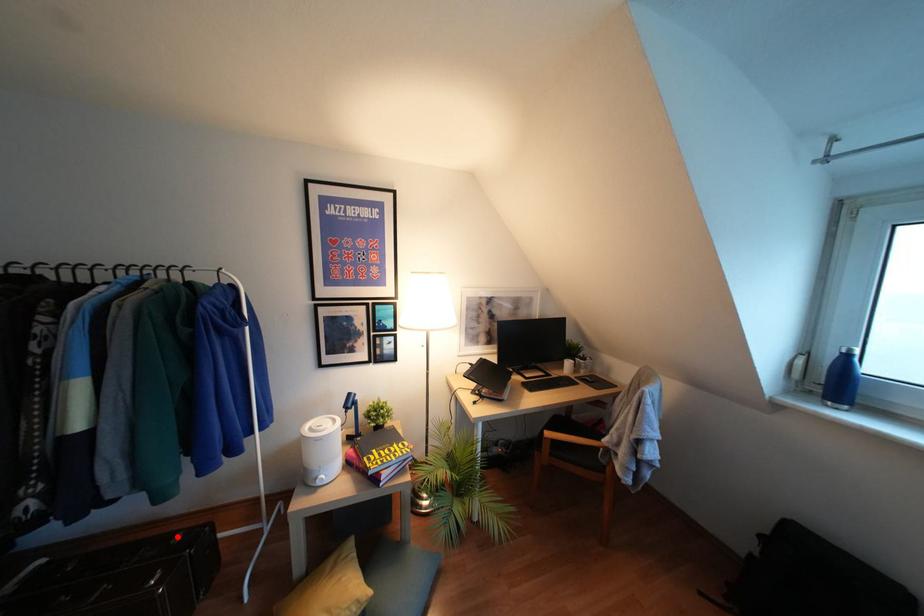
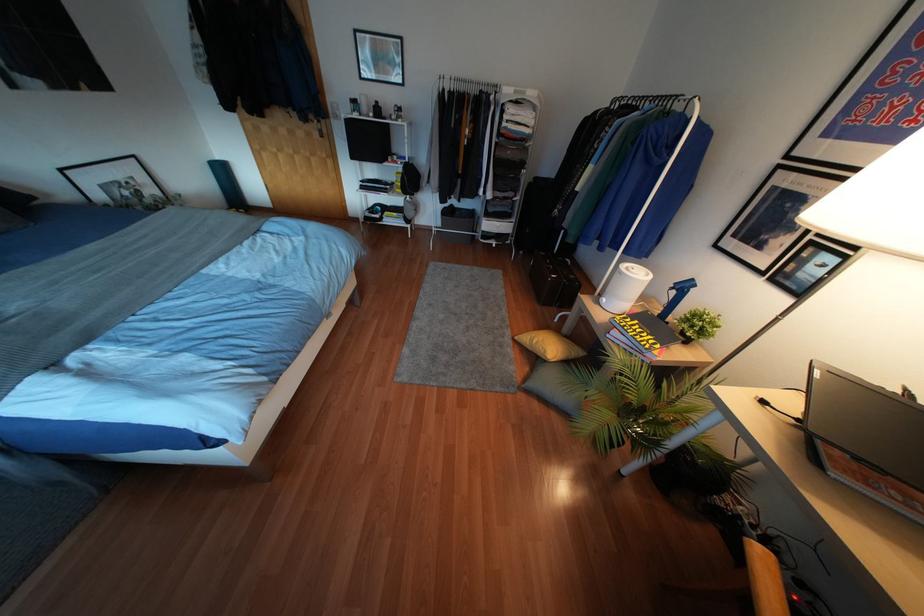
Question: I am providing you with two images of the same scene from different viewpoints. In image1, a red point is highlighted. Considering the same 3D point in image2, which of the following is correct?

Choices:
 (A) It is closer
 (B) It is farther

Answer: (A)